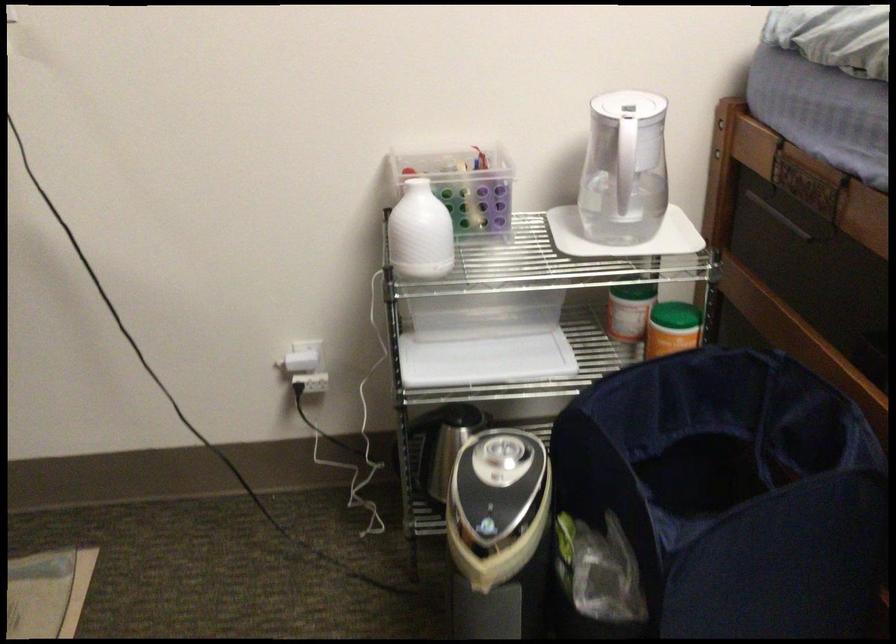
Locate an element on the screen. clear plastic bin is located at coordinates (463, 185).